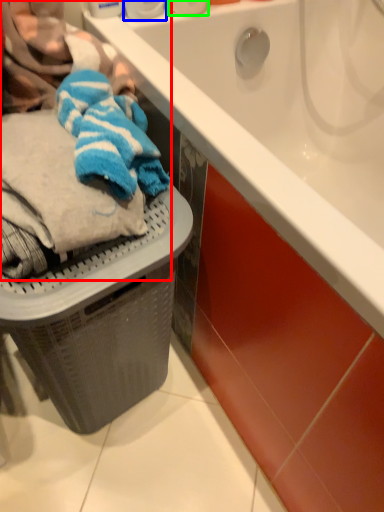
Question: Which object is the closest to the laundry (highlighted by a red box)? Choose among these: toiletry (highlighted by a blue box) or toiletry (highlighted by a green box).

Choices:
 (A) toiletry
 (B) toiletry

Answer: (A)